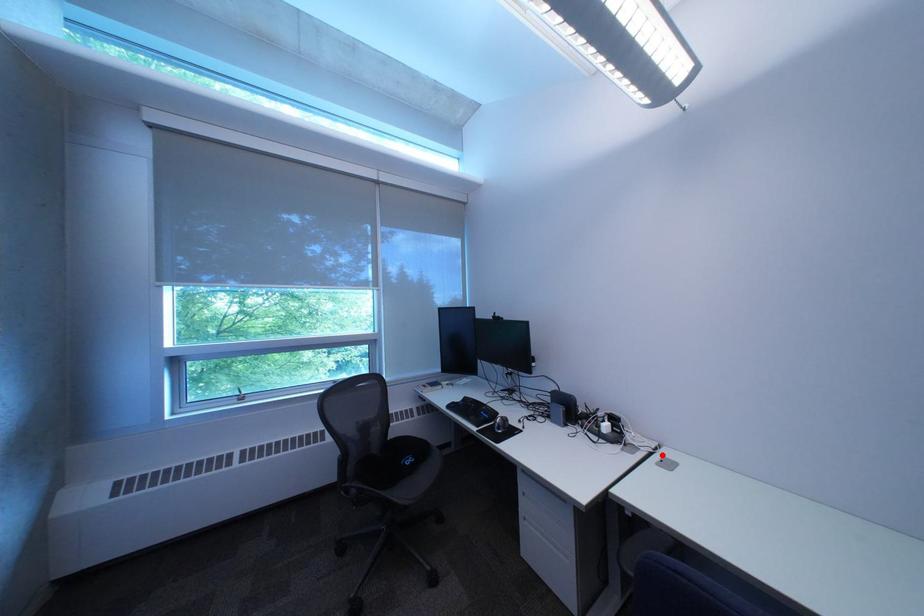
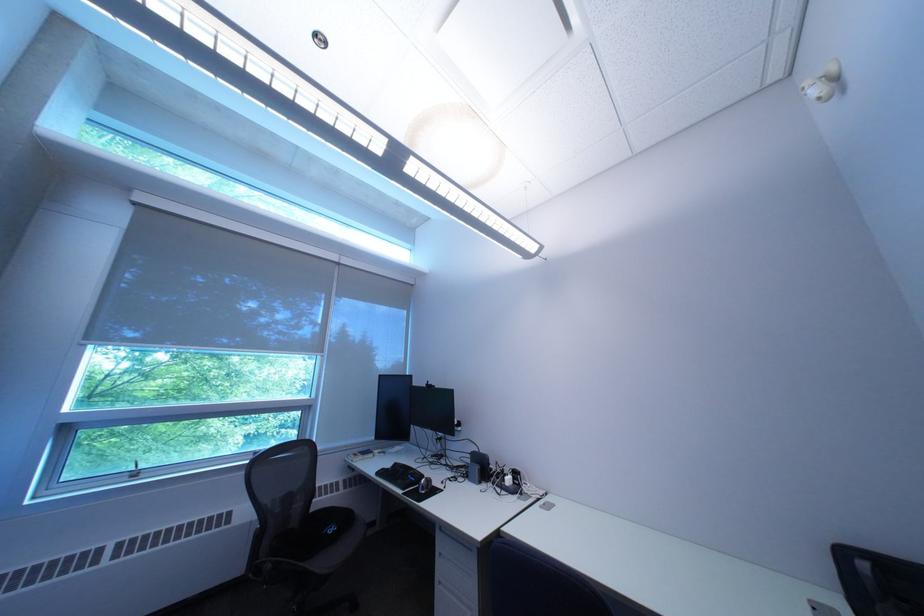
The point at the highlighted location is marked in the first image. Where is the corresponding point in the second image?

(551, 501)